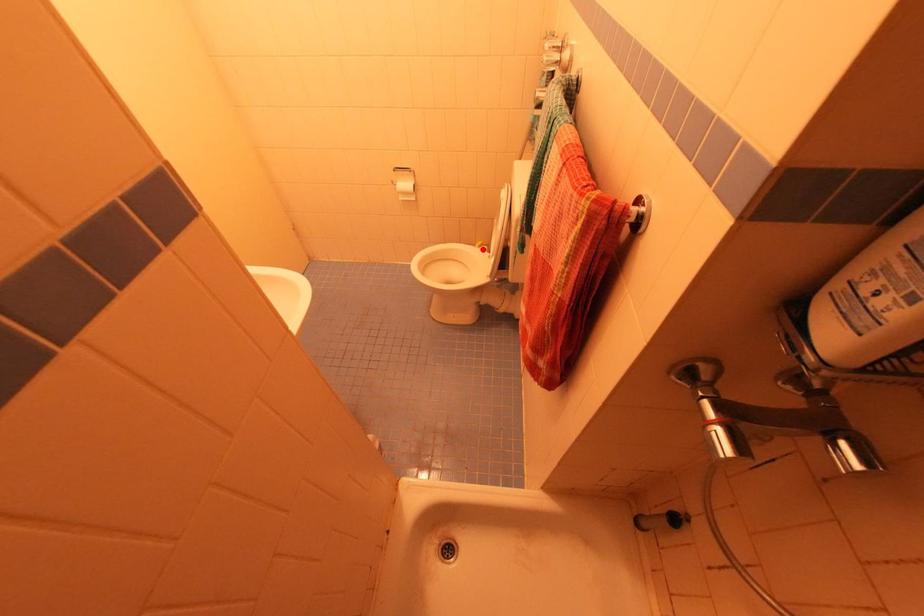
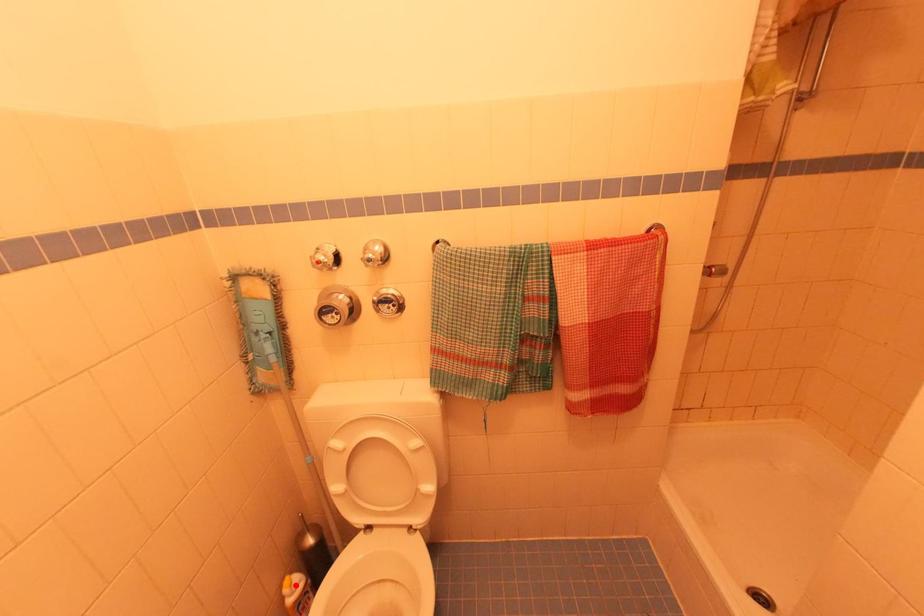
I am providing you with two images of the same scene from different viewpoints. A red point is marked on the first image and another point is marked on the second image. Do the highlighted points in image1 and image2 indicate the same real-world spot?

Yes